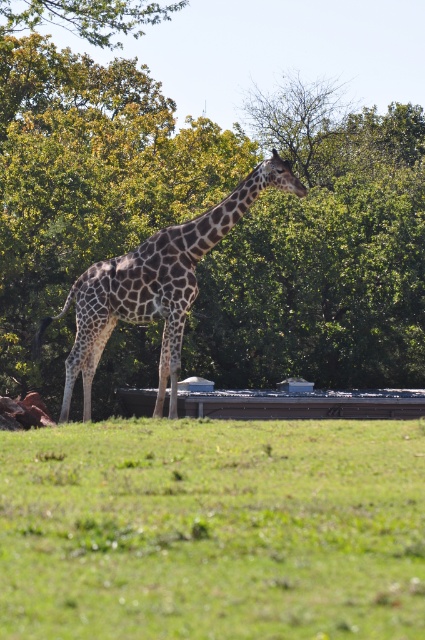
Question: Which is farther from the green grass at center?

Choices:
 (A) spotted fur giraffe at center
 (B) green leafy tree at center

Answer: (B)

Question: Can you confirm if green leafy tree at center is positioned to the right of spotted fur giraffe at center?

Choices:
 (A) yes
 (B) no

Answer: (A)

Question: Considering the real-world distances, which object is farthest from the green leafy tree at center?

Choices:
 (A) spotted fur giraffe at center
 (B) green grass at center

Answer: (B)

Question: Where is green grass at center located in relation to spotted fur giraffe at center in the image?

Choices:
 (A) left
 (B) right

Answer: (B)

Question: Which of the following is the farthest from the observer?

Choices:
 (A) spotted fur giraffe at center
 (B) green leafy tree at center
 (C) green grass at center

Answer: (B)

Question: Does green leafy tree at center appear on the left side of spotted fur giraffe at center?

Choices:
 (A) no
 (B) yes

Answer: (A)